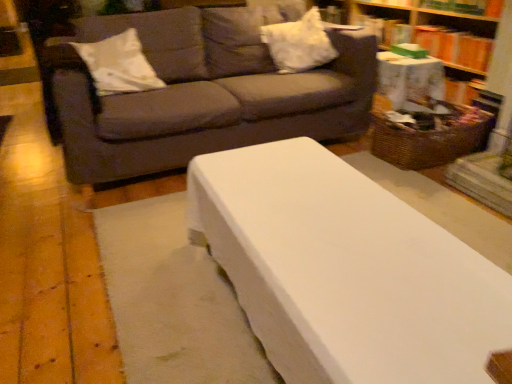
Question: From a real-world perspective, is orange cardboard book at upper right beneath white fabric pillow at upper center, the 2th pillow when ordered from left to right?

Choices:
 (A) yes
 (B) no

Answer: (A)

Question: Is orange cardboard book at upper right outside of white fabric pillow at upper center, the first pillow from the right?

Choices:
 (A) yes
 (B) no

Answer: (A)

Question: From a real-world perspective, is orange cardboard book at upper right over white fabric pillow at upper center, the first pillow from the right?

Choices:
 (A) no
 (B) yes

Answer: (A)

Question: Can you confirm if orange cardboard book at upper right is smaller than white fabric pillow at upper center, the first pillow from the right?

Choices:
 (A) no
 (B) yes

Answer: (B)

Question: Is the position of orange cardboard book at upper right less distant than that of white fabric pillow at upper center, the first pillow from the right?

Choices:
 (A) yes
 (B) no

Answer: (B)

Question: Does point (463, 77) appear closer or farther from the camera than point (416, 31)?

Choices:
 (A) farther
 (B) closer

Answer: (B)

Question: In the image, is wooden bookcase at right positioned in front of or behind orange cardboard book at upper right?

Choices:
 (A) front
 (B) behind

Answer: (A)

Question: Is wooden bookcase at right wider or thinner than orange cardboard book at upper right?

Choices:
 (A) wide
 (B) thin

Answer: (A)

Question: From a real-world perspective, is wooden bookcase at right positioned above or below orange cardboard book at upper right?

Choices:
 (A) below
 (B) above

Answer: (A)

Question: Based on their positions, is woven brown basket at right located to the left or right of white fabric pillow at upper center, the 2th pillow when ordered from left to right?

Choices:
 (A) right
 (B) left

Answer: (A)

Question: Is woven brown basket at right bigger or smaller than white fabric pillow at upper center, the 2th pillow when ordered from left to right?

Choices:
 (A) big
 (B) small

Answer: (A)

Question: Is woven brown basket at right taller or shorter than white fabric pillow at upper center, the 2th pillow when ordered from left to right?

Choices:
 (A) short
 (B) tall

Answer: (A)

Question: Which is correct: woven brown basket at right is inside white fabric pillow at upper center, the first pillow from the right, or outside of it?

Choices:
 (A) outside
 (B) inside

Answer: (A)

Question: Based on their positions, is woven brown basket at right located to the left or right of white soft pillow at upper left, which is the first pillow in left-to-right order?

Choices:
 (A) left
 (B) right

Answer: (B)

Question: From a real-world perspective, relative to white soft pillow at upper left, which is the first pillow in left-to-right order, is woven brown basket at right vertically above or below?

Choices:
 (A) below
 (B) above

Answer: (A)